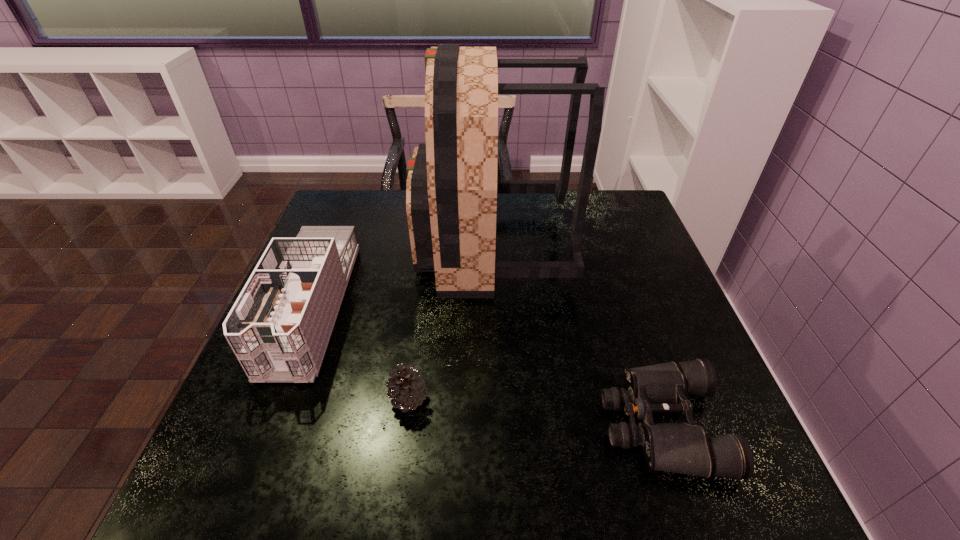
Find the location of a particular element. The width and height of the screenshot is (960, 540). the tallest object is located at coordinates (451, 190).

You are a GUI agent. You are given a task and a screenshot of the screen. Output one action in this format:
    pyautogui.click(x=<x>, y=<y>)
    Task: Click on the second tallest object
    
    Given the screenshot: What is the action you would take?
    pyautogui.click(x=279, y=327)

Identify the location of dollhouse. (279, 327).

Locate an element on the screen. Image resolution: width=960 pixels, height=540 pixels. pinecone is located at coordinates (406, 387).

Identify the location of the shortest object. (685, 448).

Where is `vacant space situated on the front face of the backpack`? This screenshot has height=540, width=960. vacant space situated on the front face of the backpack is located at coordinates (356, 246).

The image size is (960, 540). I want to click on vacant point located on the front face of the backpack, so click(x=378, y=246).

Identify the location of blank area located on the front face of the backpack. The width and height of the screenshot is (960, 540). (371, 246).

In order to click on vacant space situated at the entrance of the leftmost object in this screenshot , I will do `click(249, 465)`.

This screenshot has width=960, height=540. Find the location of `vacant space located 0.320m on the back of the second shortest object`. vacant space located 0.320m on the back of the second shortest object is located at coordinates (425, 277).